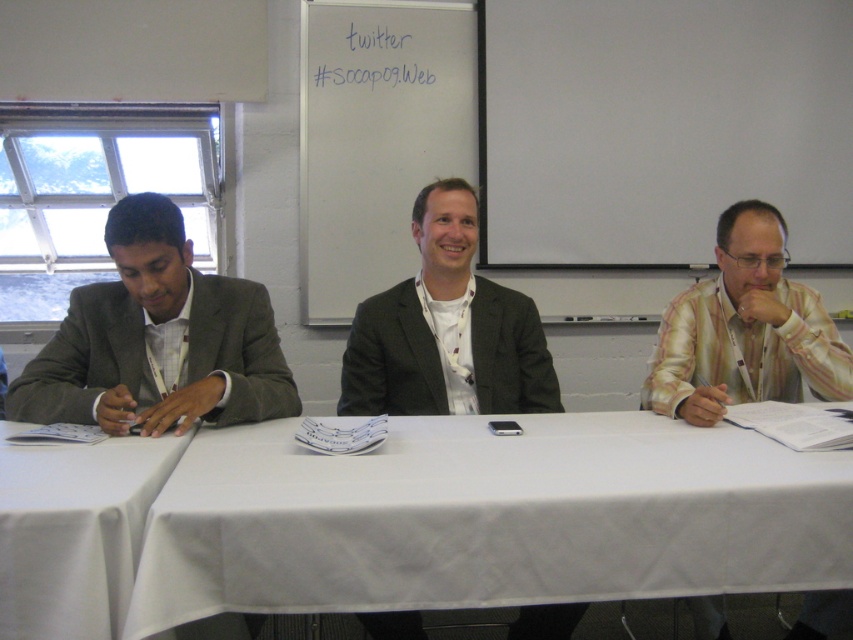
You are a person sitting at the table in the scene. You want to place a small object on the tablecloth so that it is exactly at the leftmost edge of the tablecloth. Is the point marked as point (x=74, y=531) on the tablecloth suitable for placing the object?

The point marked as point (x=74, y=531) is on the white cloth at left, so placing the object there would position it near the left edge of the tablecloth.

Based on the photo, you are organizing a meeting in a conference room with a long table. You need to place a name tag for the guest of honor. Where should you place it so that it is closest to the white cloth at left?

The name tag should be placed near the point at left where the white cloth at left is located, which is at coordinates approximately 0.830 in the x and 0.088 in the y.